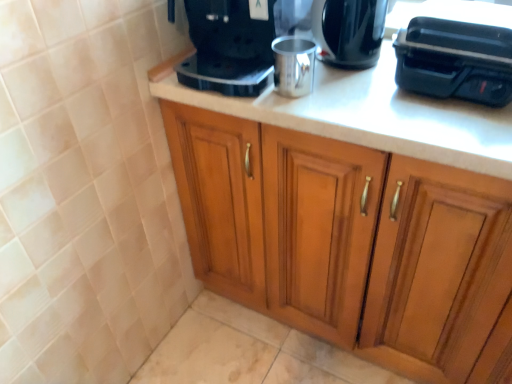
At what (x,y) coordinates should I click in order to perform the action: click on black plastic toaster at upper right, acting as the 1th appliance starting from the right. Please return your answer as a coordinate pair (x, y). The width and height of the screenshot is (512, 384). Looking at the image, I should click on (455, 60).

What do you see at coordinates (293, 65) in the screenshot? This screenshot has width=512, height=384. I see `silver metallic cup at center, positioned as the second appliance in right-to-left order` at bounding box center [293, 65].

What is the approximate width of wooden cabinet at center?

24.77 inches.

Locate an element on the screen. This screenshot has height=384, width=512. satin black coffee maker at upper center is located at coordinates (237, 43).

Is silver metallic cup at center, positioned as the second appliance in right-to-left order, looking in the opposite direction of wooden cabinet at center?

No.

From a real-world perspective, is silver metallic cup at center, the first appliance from the left, located higher than wooden cabinet at center?

Correct, in the physical world, silver metallic cup at center, the first appliance from the left, is higher than wooden cabinet at center.

Is silver metallic cup at center, the first appliance from the left, wider or thinner than wooden cabinet at center?

In the image, silver metallic cup at center, the first appliance from the left, appears to be more narrow than wooden cabinet at center.

Could you measure the distance between shiny black coffee maker at upper center and silver metallic cup at center, positioned as the second appliance in right-to-left order?

The distance of shiny black coffee maker at upper center from silver metallic cup at center, positioned as the second appliance in right-to-left order, is 4.38 inches.

Is shiny black coffee maker at upper center beside silver metallic cup at center, positioned as the second appliance in right-to-left order?

shiny black coffee maker at upper center is not next to silver metallic cup at center, positioned as the second appliance in right-to-left order, and they're not touching.

Could silver metallic cup at center, the first appliance from the left, be considered to be inside shiny black coffee maker at upper center?

Definitely not — silver metallic cup at center, the first appliance from the left, is not inside shiny black coffee maker at upper center.

Is satin black coffee maker at upper center positioned beyond the bounds of black plastic toaster at upper right, the 2th appliance positioned from the left?

Yes.

Is satin black coffee maker at upper center oriented towards black plastic toaster at upper right, the 2th appliance positioned from the left?

No, satin black coffee maker at upper center is not aimed at black plastic toaster at upper right, the 2th appliance positioned from the left.

From the picture: How many degrees apart are the facing directions of satin black coffee maker at upper center and black plastic toaster at upper right, the 2th appliance positioned from the left?

They differ by 6.99 degrees in their facing directions.

Considering the positions of objects black plastic toaster at upper right, acting as the 1th appliance starting from the right, and silver metallic cup at center, the first appliance from the left, in the image provided, who is more to the left, black plastic toaster at upper right, acting as the 1th appliance starting from the right, or silver metallic cup at center, the first appliance from the left,?

silver metallic cup at center, the first appliance from the left.

Can you confirm if black plastic toaster at upper right, the 2th appliance positioned from the left, is thinner than silver metallic cup at center, the first appliance from the left?

In fact, black plastic toaster at upper right, the 2th appliance positioned from the left, might be wider than silver metallic cup at center, the first appliance from the left.

You are a GUI agent. You are given a task and a screenshot of the screen. Output one action in this format:
    pyautogui.click(x=<x>, y=<y>)
    Task: Click on the appliance on the left of black plastic toaster at upper right, acting as the 1th appliance starting from the right
    The height and width of the screenshot is (384, 512).
    Given the screenshot: What is the action you would take?
    pyautogui.click(x=293, y=65)

Is black plastic toaster at upper right, acting as the 1th appliance starting from the right, facing away from silver metallic cup at center, positioned as the second appliance in right-to-left order?

black plastic toaster at upper right, acting as the 1th appliance starting from the right, does not have its back to silver metallic cup at center, positioned as the second appliance in right-to-left order.

Based on the photo, is satin black coffee maker at upper center spatially inside shiny black coffee maker at upper center, or outside of it?

satin black coffee maker at upper center lies outside shiny black coffee maker at upper center.

Which object is further away from the camera, satin black coffee maker at upper center or shiny black coffee maker at upper center?

shiny black coffee maker at upper center is further from the camera.

Is point (272, 13) closer or farther from the camera than point (332, 64)?

Point (272, 13) appears to be closer to the viewer than point (332, 64).

Can you confirm if black plastic toaster at upper right, the 2th appliance positioned from the left, is positioned to the left of shiny black coffee maker at upper center?

No.

Is black plastic toaster at upper right, acting as the 1th appliance starting from the right, shorter than shiny black coffee maker at upper center?

Yes, black plastic toaster at upper right, acting as the 1th appliance starting from the right, is shorter than shiny black coffee maker at upper center.

Could you tell me if black plastic toaster at upper right, the 2th appliance positioned from the left, is turned towards shiny black coffee maker at upper center?

No, black plastic toaster at upper right, the 2th appliance positioned from the left, is not turned towards shiny black coffee maker at upper center.

Is wooden cabinet at center further to the viewer compared to shiny black coffee maker at upper center?

No.

Based on their sizes in the image, would you say wooden cabinet at center is bigger or smaller than shiny black coffee maker at upper center?

In the image, wooden cabinet at center appears to be larger than shiny black coffee maker at upper center.

How different are the orientations of wooden cabinet at center and shiny black coffee maker at upper center in degrees?

The facing directions of wooden cabinet at center and shiny black coffee maker at upper center are 0.7 degrees apart.

Based on the photo, is wooden cabinet at center situated inside shiny black coffee maker at upper center or outside?

wooden cabinet at center lies outside shiny black coffee maker at upper center.

At what (x,y) coordinates should I click in order to perform the action: click on appliance to the left of wooden cabinet at center. Please return your answer as a coordinate pair (x, y). Image resolution: width=512 pixels, height=384 pixels. Looking at the image, I should click on (293, 65).

There is a silver metallic cup at center, positioned as the second appliance in right-to-left order. At what (x,y) coordinates should I click in order to perform the action: click on kitchen appliance above it (from a real-world perspective). Please return your answer as a coordinate pair (x, y). The image size is (512, 384). Looking at the image, I should click on (349, 31).

From the image, which object appears to be farther from wooden cabinet at center, silver metallic cup at center, the first appliance from the left, or shiny black coffee maker at upper center?

Among the two, shiny black coffee maker at upper center is located further to wooden cabinet at center.

Considering their positions, is wooden cabinet at center positioned further to satin black coffee maker at upper center than shiny black coffee maker at upper center?

Based on the image, wooden cabinet at center appears to be further to satin black coffee maker at upper center.

Based on the photo, when comparing their distances from black plastic toaster at upper right, the 2th appliance positioned from the left, does wooden cabinet at center or satin black coffee maker at upper center seem further?

wooden cabinet at center.

From the image, which object appears to be farther from silver metallic cup at center, positioned as the second appliance in right-to-left order, black plastic toaster at upper right, the 2th appliance positioned from the left, or shiny black coffee maker at upper center?

Based on the image, black plastic toaster at upper right, the 2th appliance positioned from the left, appears to be further to silver metallic cup at center, positioned as the second appliance in right-to-left order.

Considering their positions, is silver metallic cup at center, positioned as the second appliance in right-to-left order, positioned further to satin black coffee maker at upper center than shiny black coffee maker at upper center?

Among the two, shiny black coffee maker at upper center is located further to satin black coffee maker at upper center.

When comparing their distances from black plastic toaster at upper right, the 2th appliance positioned from the left, does wooden cabinet at center or silver metallic cup at center, positioned as the second appliance in right-to-left order, seem closer?

silver metallic cup at center, positioned as the second appliance in right-to-left order.

Looking at the image, which one is located further to wooden cabinet at center, satin black coffee maker at upper center or silver metallic cup at center, positioned as the second appliance in right-to-left order?

silver metallic cup at center, positioned as the second appliance in right-to-left order, lies further to wooden cabinet at center than the other object.

Considering their positions, is shiny black coffee maker at upper center positioned closer to wooden cabinet at center than satin black coffee maker at upper center?

The object closer to wooden cabinet at center is satin black coffee maker at upper center.

Locate an element on the screen. Image resolution: width=512 pixels, height=384 pixels. kitchen appliance between satin black coffee maker at upper center and black plastic toaster at upper right, the 2th appliance positioned from the left is located at coordinates (349, 31).

You are a GUI agent. You are given a task and a screenshot of the screen. Output one action in this format:
    pyautogui.click(x=<x>, y=<y>)
    Task: Click on the appliance between satin black coffee maker at upper center and shiny black coffee maker at upper center
    This screenshot has height=384, width=512.
    Given the screenshot: What is the action you would take?
    pyautogui.click(x=293, y=65)

At what (x,y) coordinates should I click in order to perform the action: click on appliance between black plastic toaster at upper right, acting as the 1th appliance starting from the right, and wooden cabinet at center from top to bottom. Please return your answer as a coordinate pair (x, y). This screenshot has width=512, height=384. Looking at the image, I should click on (293, 65).

What are the coordinates of `appliance between satin black coffee maker at upper center and black plastic toaster at upper right, acting as the 1th appliance starting from the right` in the screenshot? It's located at (293, 65).